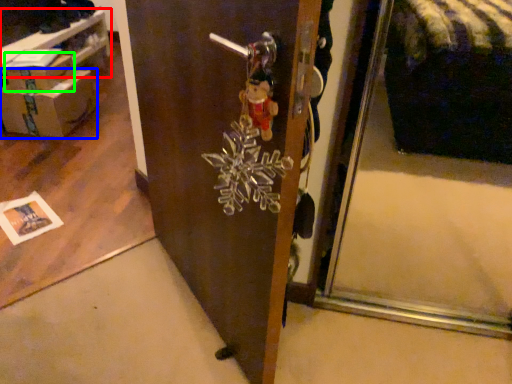
Question: Which is farther away from table (highlighted by a red box)? box (highlighted by a blue box) or cardboard box (highlighted by a green box)?

Choices:
 (A) box
 (B) cardboard box

Answer: (A)